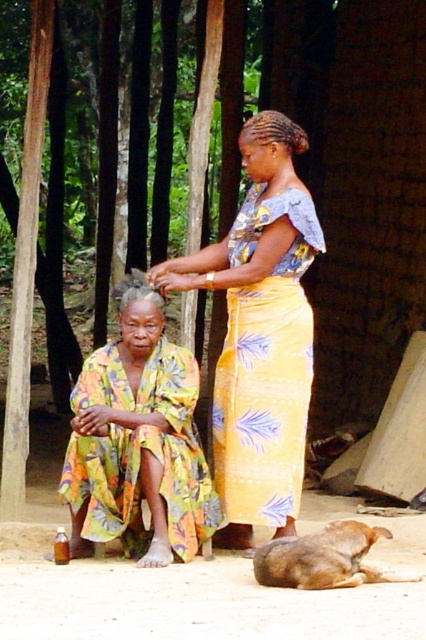
Between point (247, 445) and point (336, 531), which one is positioned behind?

Positioned behind is point (247, 445).

Between yellow printed fabric skirt at center and brown fur dog at lower right, which one appears on the left side from the viewer's perspective?

Positioned to the left is yellow printed fabric skirt at center.

Is point (224, 545) closer to camera compared to point (405, 580)?

No.

I want to click on yellow printed fabric skirt at center, so click(259, 333).

Can you confirm if yellow printed fabric skirt at center is thinner than printed fabric dress at center?

Incorrect, yellow printed fabric skirt at center's width is not less than printed fabric dress at center's.

Between yellow printed fabric skirt at center and printed fabric dress at center, which one is positioned higher?

yellow printed fabric skirt at center

Is point (229, 232) positioned behind point (147, 320)?

Yes, it is behind point (147, 320).

What are the coordinates of `yellow printed fabric skirt at center` in the screenshot? It's located at (259, 333).

Is printed fabric dress at center above brown fur dog at lower right?

Correct, printed fabric dress at center is located above brown fur dog at lower right.

How much distance is there between printed fabric dress at center and brown fur dog at lower right?

3.71 feet

Locate an element on the screen. The image size is (426, 640). printed fabric dress at center is located at coordinates (138, 442).